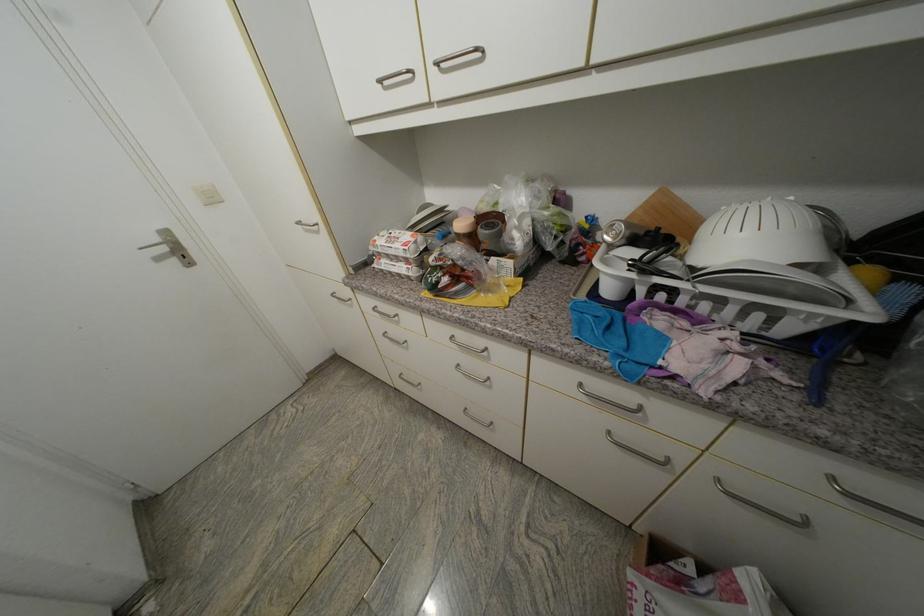
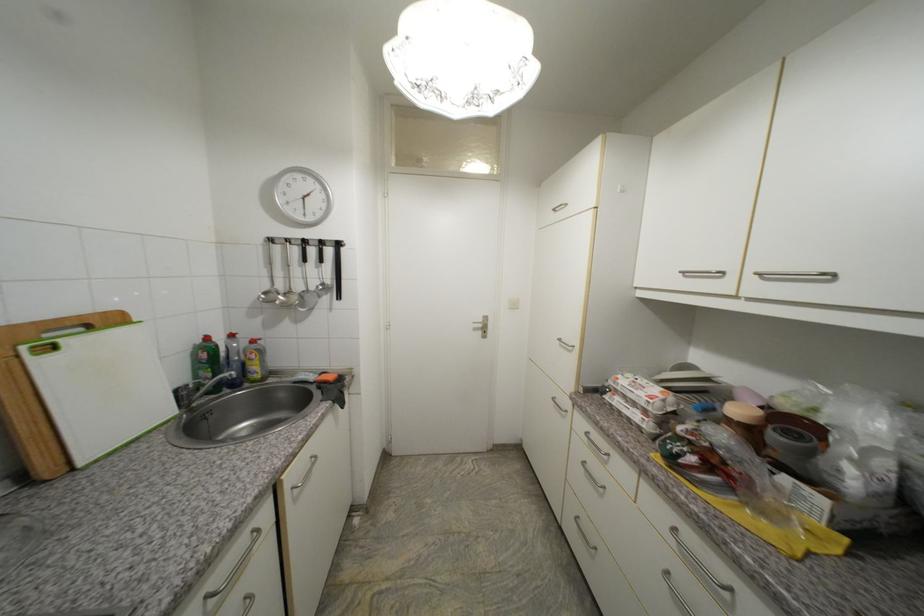
The point at (381,243) is marked in the first image. Where is the corresponding point in the second image?

(623, 379)